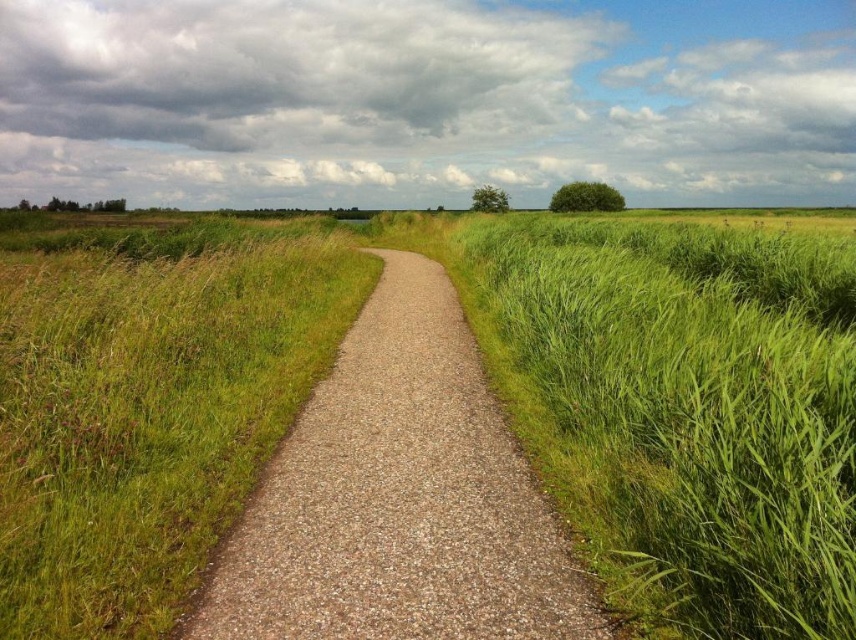
You are standing at the edge of a green grassy wheat field at center and want to walk towards the scattered trees in the background. The path is narrow and flanked by vegetation. If your walking path is 2.91 meters long, will you reach the trees before the path ends?

The distance between the green grassy wheat field at center and the camera is 2.91 meters. Since the path is narrow and flanked by vegetation, you will reach the trees before the path ends because the path length matches the given distance.

You are standing at the starting point of the path and want to reach the point marked as point [688,586]. There is an obstacle at point [348,467]. Will you encounter this obstacle before reaching your destination?

Point [688,586] is in front of point [348,467], so you will not encounter the obstacle at point [348,467] before reaching your destination.

You are standing on the brown gravel path at center and looking towards the green grassy wheat field at center. Which object is closer to you?

The green grassy wheat field at center is closer to you because it is in front of the brown gravel path at center.